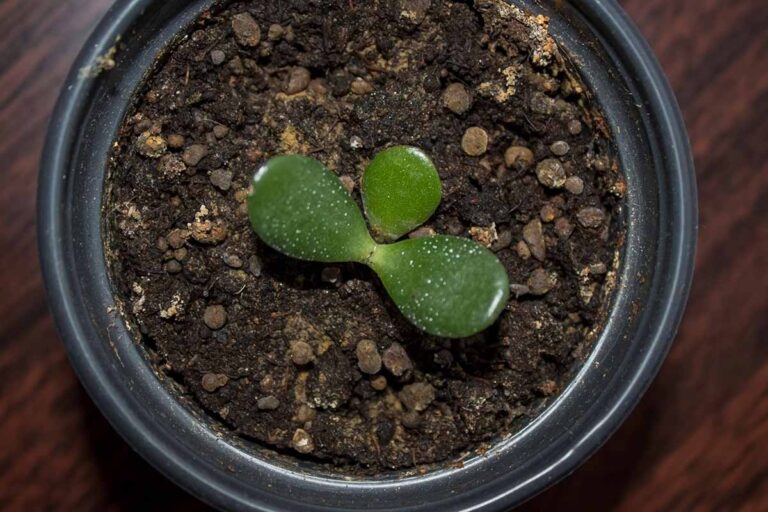
The image size is (768, 512). Identify the location of wood tabletop to left of pot. (15, 242).